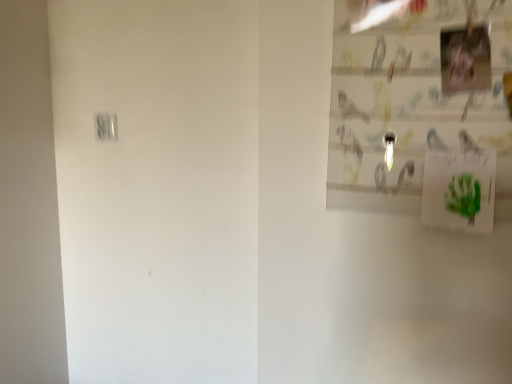
This screenshot has width=512, height=384. What do you see at coordinates (106, 126) in the screenshot? I see `white plastic light switch at upper left` at bounding box center [106, 126].

This screenshot has width=512, height=384. I want to click on white plastic light switch at upper left, so click(106, 126).

You are a GUI agent. You are given a task and a screenshot of the screen. Output one action in this format:
    pyautogui.click(x=<x>, y=<y>)
    Task: Click on the green paper postcard at upper right
    The height and width of the screenshot is (384, 512).
    Given the screenshot: What is the action you would take?
    pyautogui.click(x=459, y=191)

The height and width of the screenshot is (384, 512). What do you see at coordinates (459, 191) in the screenshot?
I see `green paper postcard at upper right` at bounding box center [459, 191].

You are a GUI agent. You are given a task and a screenshot of the screen. Output one action in this format:
    pyautogui.click(x=<x>, y=<y>)
    Task: Click on the white plastic light switch at upper left
    This screenshot has height=384, width=512.
    Given the screenshot: What is the action you would take?
    pyautogui.click(x=106, y=126)

Would you say white plastic light switch at upper left is to the left or to the right of green paper postcard at upper right in the picture?

white plastic light switch at upper left is to the left of green paper postcard at upper right.

Consider the image. Does white plastic light switch at upper left lie in front of green paper postcard at upper right?

No, the depth of white plastic light switch at upper left is greater than that of green paper postcard at upper right.

Does point (116, 132) come in front of point (450, 204)?

No.

From the image's perspective, is white plastic light switch at upper left beneath green paper postcard at upper right?

Actually, white plastic light switch at upper left appears above green paper postcard at upper right in the image.

From a real-world perspective, who is located lower, white plastic light switch at upper left or green paper postcard at upper right?

In real-world perspective, green paper postcard at upper right is lower.

Which of these two, white plastic light switch at upper left or green paper postcard at upper right, is thinner?

white plastic light switch at upper left.

Is white plastic light switch at upper left taller than green paper postcard at upper right?

In fact, white plastic light switch at upper left may be shorter than green paper postcard at upper right.

Considering the relative sizes of white plastic light switch at upper left and green paper postcard at upper right in the image provided, is white plastic light switch at upper left bigger than green paper postcard at upper right?

No, white plastic light switch at upper left is not bigger than green paper postcard at upper right.

Is white plastic light switch at upper left not within green paper postcard at upper right?

Yes, white plastic light switch at upper left is outside of green paper postcard at upper right.

Is white plastic light switch at upper left with green paper postcard at upper right?

No.

Is white plastic light switch at upper left oriented towards green paper postcard at upper right?

No, white plastic light switch at upper left is not oriented towards green paper postcard at upper right.

How much distance is there between white plastic light switch at upper left and green paper postcard at upper right?

A distance of 36.81 inches exists between white plastic light switch at upper left and green paper postcard at upper right.

Find the location of `postcard on the right of white plastic light switch at upper left`. postcard on the right of white plastic light switch at upper left is located at coordinates (459, 191).

Which is more to the left, green paper postcard at upper right or white plastic light switch at upper left?

From the viewer's perspective, white plastic light switch at upper left appears more on the left side.

From the picture: Does green paper postcard at upper right come behind white plastic light switch at upper left?

No, green paper postcard at upper right is in front of white plastic light switch at upper left.

Which is farther from the camera, (474, 175) or (95, 114)?

Point (95, 114)

Looking at this image, from the image's perspective, is green paper postcard at upper right below white plastic light switch at upper left?

Yes.

From a real-world perspective, which object stands above the other?

white plastic light switch at upper left is physically above.

Which object is wider, green paper postcard at upper right or white plastic light switch at upper left?

green paper postcard at upper right is wider.

Between green paper postcard at upper right and white plastic light switch at upper left, which one has more height?

green paper postcard at upper right is taller.

Considering the relative sizes of green paper postcard at upper right and white plastic light switch at upper left in the image provided, is green paper postcard at upper right smaller than white plastic light switch at upper left?

No.

Choose the correct answer: Is green paper postcard at upper right inside white plastic light switch at upper left or outside it?

green paper postcard at upper right lies outside white plastic light switch at upper left.

Is green paper postcard at upper right not near white plastic light switch at upper left?

No, green paper postcard at upper right is in close proximity to white plastic light switch at upper left.

In the scene shown: Is green paper postcard at upper right facing towards white plastic light switch at upper left?

No.

Can you tell me how much green paper postcard at upper right and white plastic light switch at upper left differ in facing direction?

0.00251 degrees separate the facing orientations of green paper postcard at upper right and white plastic light switch at upper left.

This screenshot has width=512, height=384. I want to click on light switch behind the green paper postcard at upper right, so click(x=106, y=126).

This screenshot has height=384, width=512. I want to click on light switch on the left of the green paper postcard at upper right, so click(x=106, y=126).

Find the location of a particular element. The height and width of the screenshot is (384, 512). postcard below the white plastic light switch at upper left (from a real-world perspective) is located at coordinates (459, 191).